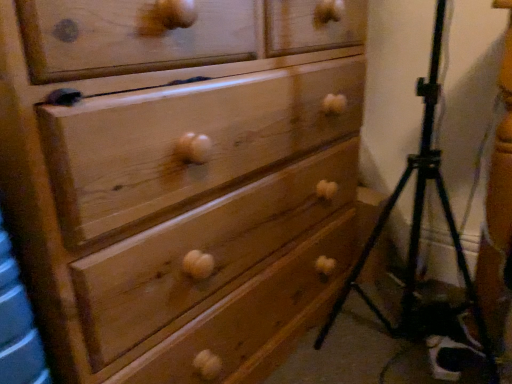
At what (x,y) coordinates should I click in order to perform the action: click on wooden chest of drawers at center. Please return your answer as a coordinate pair (x, y). The width and height of the screenshot is (512, 384). Looking at the image, I should click on (179, 181).

This screenshot has width=512, height=384. What do you see at coordinates (179, 181) in the screenshot? I see `wooden chest of drawers at center` at bounding box center [179, 181].

I want to click on black metal tripod at lower right, so click(419, 219).

What do you see at coordinates (419, 219) in the screenshot? I see `black metal tripod at lower right` at bounding box center [419, 219].

You are a GUI agent. You are given a task and a screenshot of the screen. Output one action in this format:
    pyautogui.click(x=<x>, y=<y>)
    Task: Click on the wooden chest of drawers at center
    
    Given the screenshot: What is the action you would take?
    click(x=179, y=181)

Is wooden chest of drawers at center at the left side of black metal tripod at lower right?

Correct, you'll find wooden chest of drawers at center to the left of black metal tripod at lower right.

Does wooden chest of drawers at center come in front of black metal tripod at lower right?

Yes, wooden chest of drawers at center is in front of black metal tripod at lower right.

Does point (202, 5) come closer to viewer compared to point (322, 329)?

Yes, point (202, 5) is in front of point (322, 329).

From the image's perspective, is wooden chest of drawers at center on top of black metal tripod at lower right?

Indeed, from the image's perspective, wooden chest of drawers at center is shown above black metal tripod at lower right.

From the picture: From a real-world perspective, is wooden chest of drawers at center positioned above or below black metal tripod at lower right?

wooden chest of drawers at center is situated higher than black metal tripod at lower right in the real world.

Looking at this image, considering the sizes of objects wooden chest of drawers at center and black metal tripod at lower right in the image provided, who is thinner, wooden chest of drawers at center or black metal tripod at lower right?

black metal tripod at lower right is thinner.

Which of these two, wooden chest of drawers at center or black metal tripod at lower right, stands taller?

wooden chest of drawers at center is taller.

Considering the sizes of objects wooden chest of drawers at center and black metal tripod at lower right in the image provided, who is smaller, wooden chest of drawers at center or black metal tripod at lower right?

black metal tripod at lower right.

Is wooden chest of drawers at center inside the boundaries of black metal tripod at lower right, or outside?

wooden chest of drawers at center is not inside black metal tripod at lower right, it's outside.

Can you see wooden chest of drawers at center touching black metal tripod at lower right?

No, wooden chest of drawers at center is not in contact with black metal tripod at lower right.

Is wooden chest of drawers at center oriented away from black metal tripod at lower right?

No, black metal tripod at lower right is not at the back of wooden chest of drawers at center.

Can you tell me how much wooden chest of drawers at center and black metal tripod at lower right differ in facing direction?

The angular difference between wooden chest of drawers at center and black metal tripod at lower right is 5.56 degrees.

I want to click on chest of drawers on the left of black metal tripod at lower right, so click(x=179, y=181).

Is black metal tripod at lower right at the left side of wooden chest of drawers at center?

No, black metal tripod at lower right is not to the left of wooden chest of drawers at center.

Looking at this image, who is more distant, black metal tripod at lower right or wooden chest of drawers at center?

black metal tripod at lower right.

Does point (440, 4) come closer to viewer compared to point (264, 272)?

That is False.

From the image's perspective, is black metal tripod at lower right located beneath wooden chest of drawers at center?

Yes.

From a real-world perspective, is black metal tripod at lower right above or below wooden chest of drawers at center?

black metal tripod at lower right is below wooden chest of drawers at center.

Is black metal tripod at lower right wider than wooden chest of drawers at center?

Incorrect, the width of black metal tripod at lower right does not surpass that of wooden chest of drawers at center.

Which of these two, black metal tripod at lower right or wooden chest of drawers at center, stands taller?

Standing taller between the two is wooden chest of drawers at center.

Is black metal tripod at lower right bigger than wooden chest of drawers at center?

No, black metal tripod at lower right is not bigger than wooden chest of drawers at center.

Is black metal tripod at lower right spatially inside wooden chest of drawers at center, or outside of it?

black metal tripod at lower right is not enclosed by wooden chest of drawers at center.

Are black metal tripod at lower right and wooden chest of drawers at center making contact?

No, black metal tripod at lower right is not next to wooden chest of drawers at center.

Is black metal tripod at lower right looking in the opposite direction of wooden chest of drawers at center?

That's right, black metal tripod at lower right is facing away from wooden chest of drawers at center.

I want to click on tripod on the right of wooden chest of drawers at center, so click(x=419, y=219).

You are a GUI agent. You are given a task and a screenshot of the screen. Output one action in this format:
    pyautogui.click(x=<x>, y=<y>)
    Task: Click on the chest of drawers in front of the black metal tripod at lower right
    The image size is (512, 384).
    Given the screenshot: What is the action you would take?
    pyautogui.click(x=179, y=181)

The height and width of the screenshot is (384, 512). I want to click on tripod below the wooden chest of drawers at center (from the image's perspective), so click(419, 219).